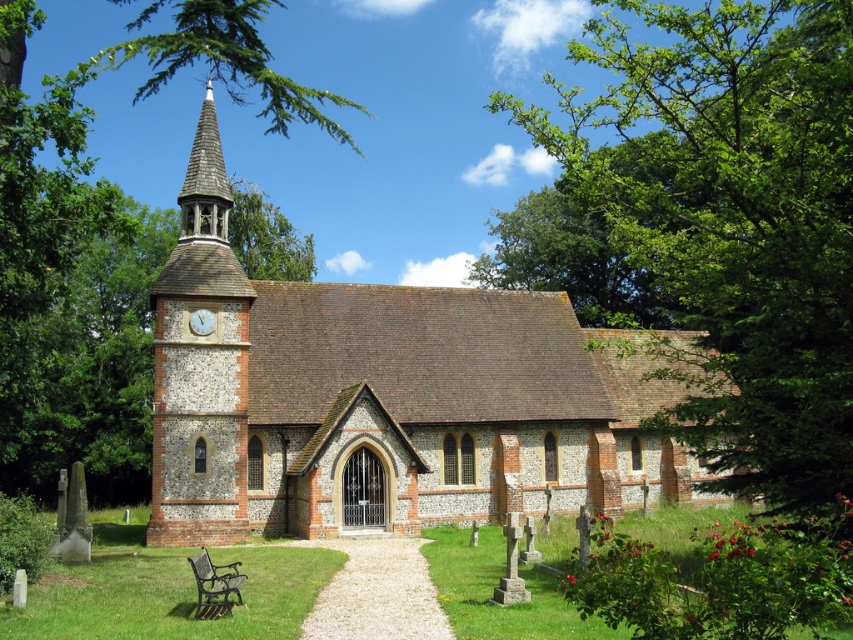
Question: Which of the following is the closest to the observer?

Choices:
 (A) (366, 332)
 (B) (223, 240)
 (C) (755, 100)
 (D) (212, 314)

Answer: (C)

Question: Can you confirm if green leafy tree at upper left is positioned to the right of wooden shingles spire at upper center?

Choices:
 (A) yes
 (B) no

Answer: (B)

Question: Is brick church at center smaller than green leafy tree at upper right?

Choices:
 (A) yes
 (B) no

Answer: (A)

Question: Which object is farther from the camera taking this photo?

Choices:
 (A) brick church at center
 (B) green leafy tree at upper right
 (C) light blue stone clock at center
 (D) wooden shingles spire at upper center

Answer: (D)

Question: Which of the following is the farthest from the observer?

Choices:
 (A) (38, 316)
 (B) (199, 310)
 (C) (729, 305)

Answer: (B)

Question: Does brick church at center come behind wooden shingles spire at upper center?

Choices:
 (A) yes
 (B) no

Answer: (B)